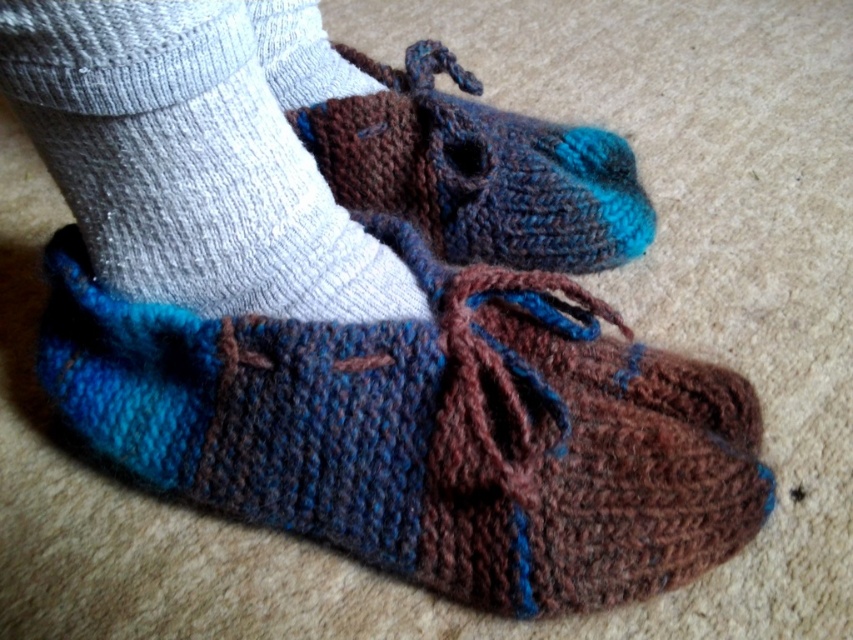
How much distance is there between blue knitted moccasin at center and knitted woolen moccasin at center?

The distance of blue knitted moccasin at center from knitted woolen moccasin at center is 29.96 centimeters.

Who is more forward, (337, 368) or (463, 236)?

Point (337, 368) is more forward.

What do you see at coordinates (426, 429) in the screenshot? The width and height of the screenshot is (853, 640). I see `blue knitted moccasin at center` at bounding box center [426, 429].

Where is `blue knitted moccasin at center`? The width and height of the screenshot is (853, 640). blue knitted moccasin at center is located at coordinates (426, 429).

Can you confirm if blue knitted moccasin at center is positioned below knitted wool sock at lower left?

Indeed, blue knitted moccasin at center is positioned under knitted wool sock at lower left.

Which is more to the left, blue knitted moccasin at center or knitted wool sock at lower left?

knitted wool sock at lower left is more to the left.

I want to click on blue knitted moccasin at center, so click(426, 429).

The width and height of the screenshot is (853, 640). I want to click on blue knitted moccasin at center, so click(426, 429).

Can you confirm if knitted wool sock at lower left is positioned above knitted woolen moccasin at center?

Actually, knitted wool sock at lower left is below knitted woolen moccasin at center.

Does knitted wool sock at lower left have a smaller size compared to knitted woolen moccasin at center?

Yes.

This screenshot has width=853, height=640. Describe the element at coordinates (198, 152) in the screenshot. I see `knitted wool sock at lower left` at that location.

The width and height of the screenshot is (853, 640). What are the coordinates of `knitted wool sock at lower left` in the screenshot? It's located at (198, 152).